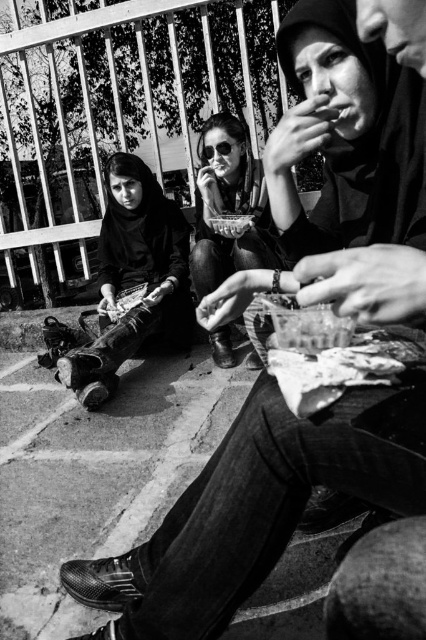
Does point (111, 211) lie behind point (216, 241)?

Yes, it is behind point (216, 241).

Who is lower down, matte black clothing at center or sunglasses at center?

Positioned lower is matte black clothing at center.

At what (x,y) coordinates should I click in order to perform the action: click on matte black clothing at center. Please return your answer as a coordinate pair (x, y). The image size is (426, 640). Looking at the image, I should click on (134, 280).

This screenshot has width=426, height=640. What are the coordinates of `matte black clothing at center` in the screenshot? It's located at [134, 280].